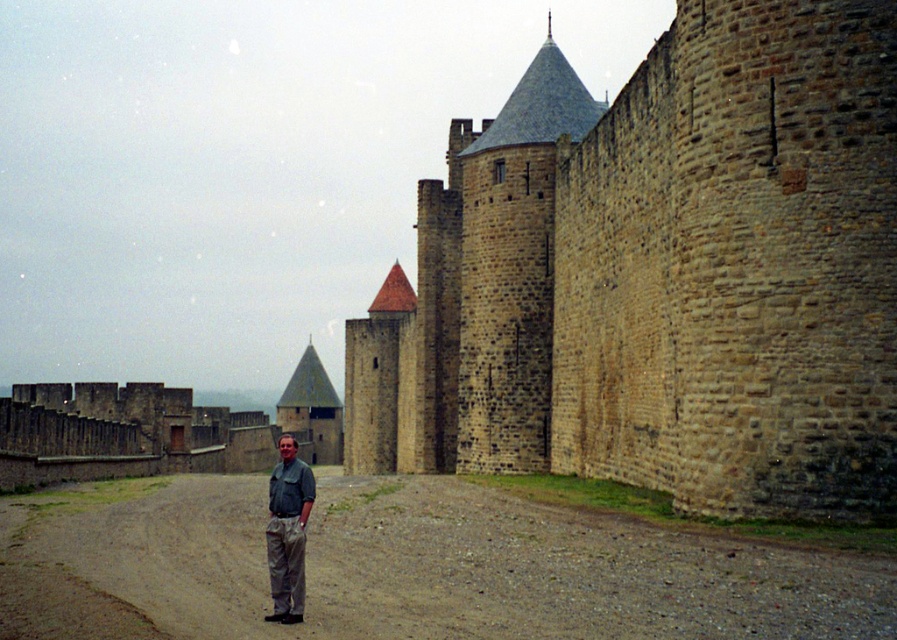
Which of these two, brown stone wall at center or brown gravel road at center, stands shorter?

With less height is brown gravel road at center.

Consider the image. Does brown stone wall at center appear on the right side of brown gravel road at center?

Yes, brown stone wall at center is to the right of brown gravel road at center.

Describe the element at coordinates (660, 275) in the screenshot. I see `brown stone wall at center` at that location.

This screenshot has width=897, height=640. Identify the location of brown stone wall at center. (660, 275).

How distant is brown gravel road at center from khaki pants at center?

brown gravel road at center is 33.52 feet away from khaki pants at center.

From the picture: Can you confirm if brown gravel road at center is positioned to the right of khaki pants at center?

Indeed, brown gravel road at center is positioned on the right side of khaki pants at center.

Between point (560, 548) and point (277, 605), which one is positioned in front?

Point (277, 605) is more forward.

This screenshot has width=897, height=640. Find the location of `brown gravel road at center`. brown gravel road at center is located at coordinates [411, 570].

Is brown stone wall at center shorter than khaki pants at center?

In fact, brown stone wall at center may be taller than khaki pants at center.

Is brown stone wall at center to the left of khaki pants at center from the viewer's perspective?

No, brown stone wall at center is not to the left of khaki pants at center.

Does point (806, 428) come closer to viewer compared to point (284, 593)?

No, it is behind (284, 593).

Locate an element on the screen. The image size is (897, 640). brown stone wall at center is located at coordinates (660, 275).